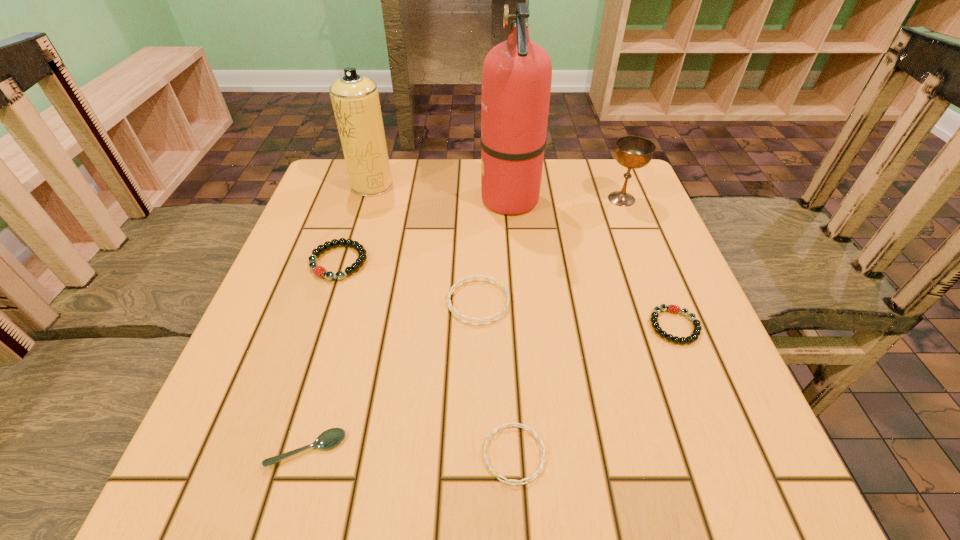
At what (x,y) coordinates should I click in order to perform the action: click on bracelet that is at the left edge. Please return your answer as a coordinate pair (x, y). The width and height of the screenshot is (960, 540). Looking at the image, I should click on (319, 271).

The height and width of the screenshot is (540, 960). In order to click on soupspoon situated at the left edge in this screenshot , I will do `click(330, 438)`.

I want to click on chalice that is at the right edge, so click(633, 152).

This screenshot has height=540, width=960. Identify the location of bracelet that is at the right edge. (696, 332).

Where is `object that is positioned at the far left corner`? The width and height of the screenshot is (960, 540). object that is positioned at the far left corner is located at coordinates (355, 99).

Where is `object that is positioned at the near left corner`? This screenshot has height=540, width=960. object that is positioned at the near left corner is located at coordinates (330, 438).

Identify the location of object present at the far right corner. (633, 152).

At what (x,y) coordinates should I click in order to perform the action: click on free space at the far edge. Please return your answer as a coordinate pair (x, y). Looking at the image, I should click on (550, 184).

Where is `vacant region at the near edge of the desktop`? vacant region at the near edge of the desktop is located at coordinates (482, 457).

This screenshot has height=540, width=960. In order to click on vacant space at the left edge of the desktop in this screenshot , I will do `click(310, 226)`.